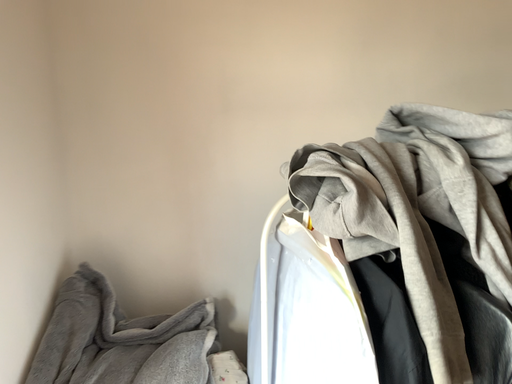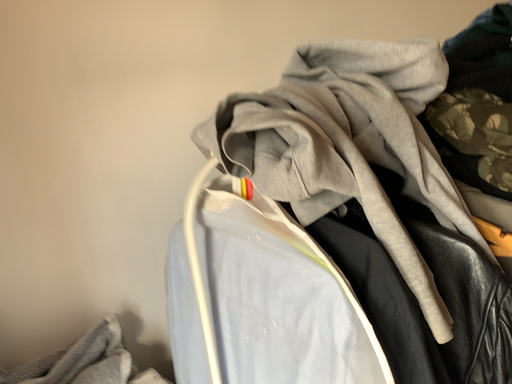
Question: How did the camera likely rotate when shooting the video?

Choices:
 (A) rotated right
 (B) rotated left

Answer: (A)